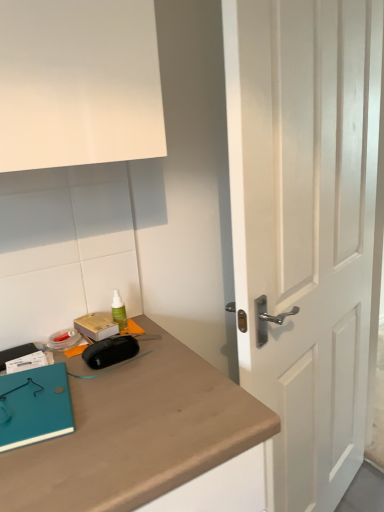
Question: Considering the relative positions of green plastic spray bottle at upper center and white wooden door at center in the image provided, is green plastic spray bottle at upper center in front of white wooden door at center?

Choices:
 (A) no
 (B) yes

Answer: (A)

Question: Is green plastic spray bottle at upper center shorter than white wooden door at center?

Choices:
 (A) yes
 (B) no

Answer: (A)

Question: Is white wooden door at center inside green plastic spray bottle at upper center?

Choices:
 (A) yes
 (B) no

Answer: (B)

Question: From a real-world perspective, is green plastic spray bottle at upper center physically above white wooden door at center?

Choices:
 (A) no
 (B) yes

Answer: (B)

Question: From a real-world perspective, does green plastic spray bottle at upper center sit lower than white wooden door at center?

Choices:
 (A) yes
 (B) no

Answer: (B)

Question: Is green plastic spray bottle at upper center wider than white wooden door at center?

Choices:
 (A) yes
 (B) no

Answer: (B)

Question: Is teal matte notebook at lower left behind white wooden door at center?

Choices:
 (A) yes
 (B) no

Answer: (A)

Question: From the image's perspective, is teal matte notebook at lower left on white wooden door at center?

Choices:
 (A) no
 (B) yes

Answer: (A)

Question: From a real-world perspective, is teal matte notebook at lower left over white wooden door at center?

Choices:
 (A) no
 (B) yes

Answer: (B)

Question: Does teal matte notebook at lower left have a lesser height compared to white wooden door at center?

Choices:
 (A) yes
 (B) no

Answer: (A)

Question: Is teal matte notebook at lower left taller than white wooden door at center?

Choices:
 (A) yes
 (B) no

Answer: (B)

Question: Is teal matte notebook at lower left at the right side of white wooden door at center?

Choices:
 (A) no
 (B) yes

Answer: (A)

Question: From a real-world perspective, is teal matte notebook at lower left located beneath green plastic spray bottle at upper center?

Choices:
 (A) yes
 (B) no

Answer: (A)